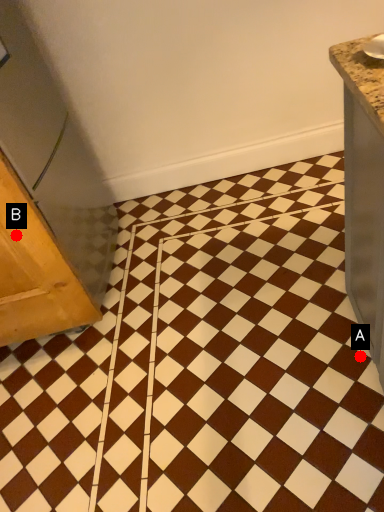
Question: Two points are circled on the image, labeled by A and B beside each circle. Which point is closer to the camera?

Choices:
 (A) A is closer
 (B) B is closer

Answer: (B)